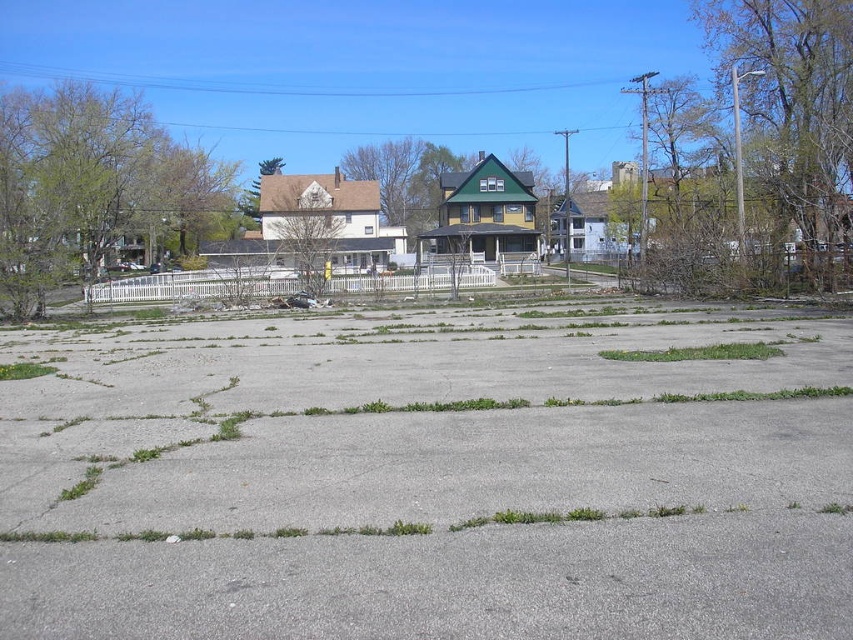
Question: Which object is positioned farthest from the green grass at center?

Choices:
 (A) gray concrete pavement at center
 (B) green soft grass at lower left

Answer: (B)

Question: Which point appears closest to the camera in this image?

Choices:
 (A) (756, 588)
 (B) (755, 346)
 (C) (22, 369)

Answer: (A)

Question: Which of the following is the closest to the observer?

Choices:
 (A) (1, 365)
 (B) (634, 369)
 (C) (643, 355)

Answer: (B)

Question: Is green grass at center wider than green soft grass at lower left?

Choices:
 (A) yes
 (B) no

Answer: (A)

Question: Can you confirm if green grass at center is positioned below green soft grass at lower left?

Choices:
 (A) yes
 (B) no

Answer: (B)

Question: Where is gray concrete pavement at center located in relation to green grass at center in the image?

Choices:
 (A) below
 (B) above

Answer: (A)